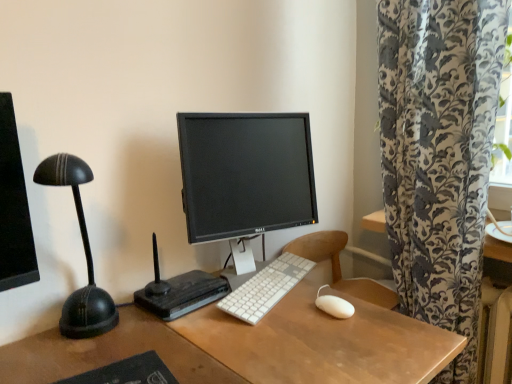
At what (x,y) coordinates should I click in order to perform the action: click on free spot above black rubber mousepad at lower left (from a real-world perspective). Please return your answer as a coordinate pair (x, y). Looking at the image, I should click on (110, 367).